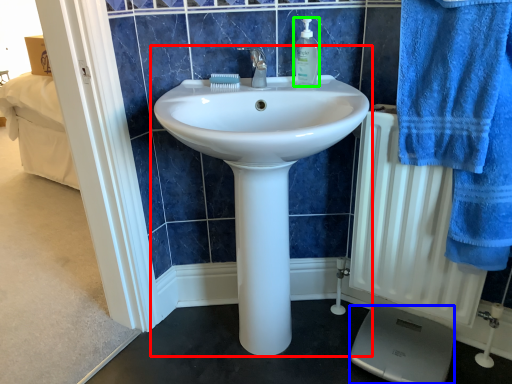
Question: Which object is the closest to the sink (highlighted by a red box)? Choose among these: scale (highlighted by a blue box) or soap dispenser (highlighted by a green box).

Choices:
 (A) scale
 (B) soap dispenser

Answer: (B)